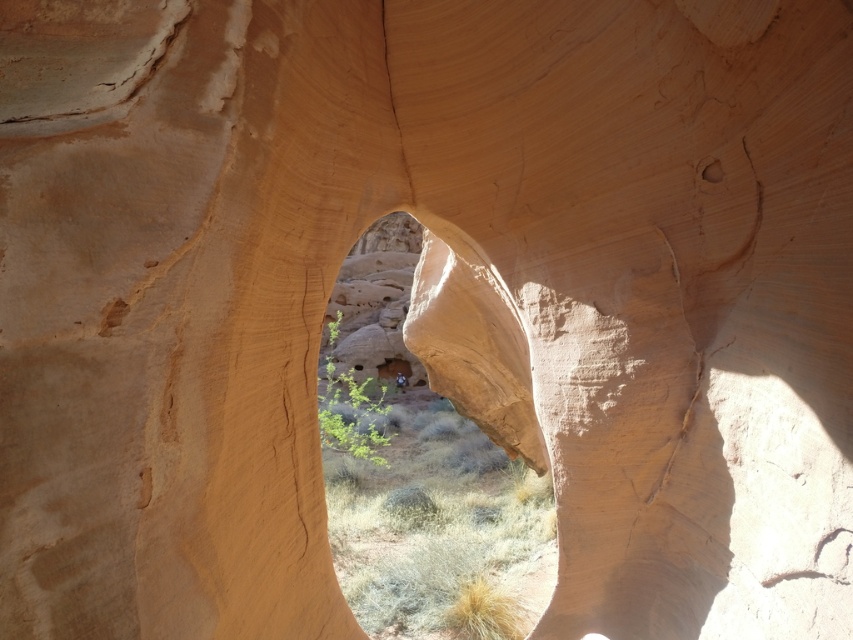
Question: Can you confirm if smooth sandstone arch at center is thinner than smooth sandstone hole at upper center?

Choices:
 (A) yes
 (B) no

Answer: (B)

Question: Does smooth sandstone arch at center appear under smooth sandstone hole at upper center?

Choices:
 (A) yes
 (B) no

Answer: (A)

Question: In this image, where is smooth sandstone arch at center located relative to smooth sandstone hole at upper center?

Choices:
 (A) left
 (B) right

Answer: (A)

Question: Which of the following is the closest to the observer?

Choices:
 (A) smooth sandstone hole at upper center
 (B) smooth sandstone arch at center

Answer: (A)

Question: Which point is closer to the camera taking this photo?

Choices:
 (A) (712, 172)
 (B) (532, 611)

Answer: (A)